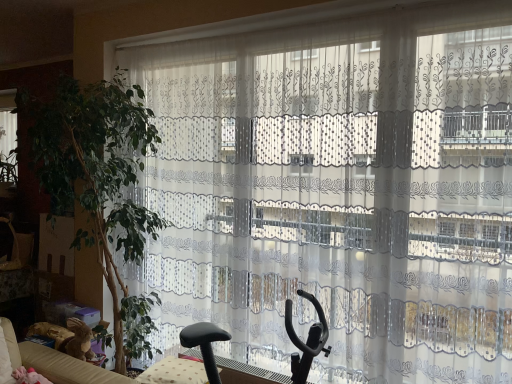
Measure the distance between black plastic swivel chair at center and camera.

A distance of 1.69 meters exists between black plastic swivel chair at center and camera.

This screenshot has width=512, height=384. In order to click on transparent lace curtain at left in this screenshot , I will do `click(8, 132)`.

From the picture: Considering the relative positions of black plastic swivel chair at center and transparent lace curtain at left in the image provided, is black plastic swivel chair at center behind transparent lace curtain at left?

No, black plastic swivel chair at center is closer to the camera.

Does black plastic swivel chair at center turn towards transparent lace curtain at left?

No, black plastic swivel chair at center does not turn towards transparent lace curtain at left.

From a real-world perspective, which object stands above the other?

transparent lace curtain at left is physically above.

Can you see black plastic swivel chair at center touching transparent lace curtain at left?

No, black plastic swivel chair at center is not beside transparent lace curtain at left.

Is point (12, 127) closer to viewer compared to point (85, 86)?

No.

Who is more distant, transparent lace curtain at left or green leafy plant at left?

transparent lace curtain at left is further from the camera.

Is transparent lace curtain at left to the left or to the right of green leafy plant at left in the image?

Based on their positions, transparent lace curtain at left is located to the left of green leafy plant at left.

Which of these two, transparent lace curtain at left or green leafy plant at left, is smaller?

transparent lace curtain at left.

Is point (84, 88) closer to viewer compared to point (11, 141)?

That is True.

Is green leafy plant at left oriented away from transparent lace curtain at left?

No, green leafy plant at left's orientation is not away from transparent lace curtain at left.

Looking at this image, from the image's perspective, is green leafy plant at left positioned above or below transparent lace curtain at left?

Based on their image positions, green leafy plant at left is located beneath transparent lace curtain at left.

Considering the relative sizes of green leafy plant at left and transparent lace curtain at left in the image provided, is green leafy plant at left smaller than transparent lace curtain at left?

No, green leafy plant at left is not smaller than transparent lace curtain at left.

This screenshot has width=512, height=384. Find the location of `window behind the black plastic swivel chair at center`. window behind the black plastic swivel chair at center is located at coordinates (8, 132).

From a real-world perspective, relative to black plastic swivel chair at center, is transparent lace curtain at left vertically above or below?

From a real-world perspective, transparent lace curtain at left is physically above black plastic swivel chair at center.

Considering the relative sizes of transparent lace curtain at left and black plastic swivel chair at center in the image provided, is transparent lace curtain at left shorter than black plastic swivel chair at center?

Correct, transparent lace curtain at left is not as tall as black plastic swivel chair at center.

Between point (320, 311) and point (108, 246), which one is positioned behind?

The point (108, 246) is farther from the camera.

From a real-world perspective, does black plastic swivel chair at center stand above green leafy plant at left?

No, from a real-world perspective, black plastic swivel chair at center is not on top of green leafy plant at left.

Is black plastic swivel chair at center facing towards green leafy plant at left?

No, black plastic swivel chair at center is not facing towards green leafy plant at left.

Does black plastic swivel chair at center have a lesser width compared to green leafy plant at left?

Indeed, black plastic swivel chair at center has a lesser width compared to green leafy plant at left.

Based on the photo, from the image's perspective, does green leafy plant at left appear higher than black plastic swivel chair at center?

Indeed, from the image's perspective, green leafy plant at left is shown above black plastic swivel chair at center.

Identify the location of plant behind the black plastic swivel chair at center. (97, 170).

Considering the positions of objects green leafy plant at left and black plastic swivel chair at center in the image provided, who is more to the right, green leafy plant at left or black plastic swivel chair at center?

Positioned to the right is black plastic swivel chair at center.

Who is bigger, green leafy plant at left or black plastic swivel chair at center?

Bigger between the two is green leafy plant at left.

In the image, there is a black plastic swivel chair at center. Where is `window above it (from the image's perspective)`? Image resolution: width=512 pixels, height=384 pixels. window above it (from the image's perspective) is located at coordinates (8, 132).

At what (x,y) coordinates should I click in order to perform the action: click on plant that appears below the transparent lace curtain at left (from a real-world perspective). Please return your answer as a coordinate pair (x, y). The width and height of the screenshot is (512, 384). Looking at the image, I should click on (97, 170).

Looking at the image, which one is located closer to green leafy plant at left, black plastic swivel chair at center or transparent lace curtain at left?

Among the two, black plastic swivel chair at center is located nearer to green leafy plant at left.

From the image, which object appears to be nearer to black plastic swivel chair at center, green leafy plant at left or transparent lace curtain at left?

A: green leafy plant at left is closer to black plastic swivel chair at center.

Based on their spatial positions, is transparent lace curtain at left or green leafy plant at left closer to black plastic swivel chair at center?

Among the two, green leafy plant at left is located nearer to black plastic swivel chair at center.

Considering their positions, is black plastic swivel chair at center positioned closer to transparent lace curtain at left than green leafy plant at left?

green leafy plant at left is positioned closer to the anchor transparent lace curtain at left.

Based on their spatial positions, is green leafy plant at left or black plastic swivel chair at center further from transparent lace curtain at left?

The object further to transparent lace curtain at left is black plastic swivel chair at center.

From the image, which object appears to be farther from green leafy plant at left, transparent lace curtain at left or black plastic swivel chair at center?

transparent lace curtain at left is further to green leafy plant at left.

At what (x,y) coordinates should I click in order to perform the action: click on plant between black plastic swivel chair at center and transparent lace curtain at left from front to back. Please return your answer as a coordinate pair (x, y). This screenshot has height=384, width=512. Looking at the image, I should click on (97, 170).